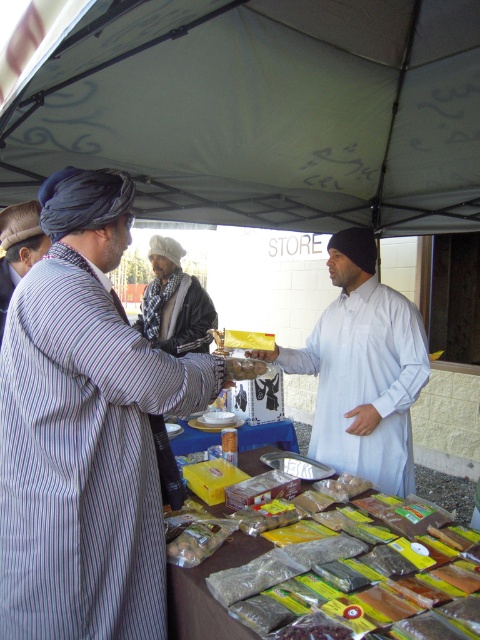
Question: Among these points, which one is farthest from the camera?

Choices:
 (A) (408, 212)
 (B) (35, 212)
 (C) (22, 356)

Answer: (A)

Question: Does striped fabric coat at left come in front of striped fabric headscarf at left?

Choices:
 (A) no
 (B) yes

Answer: (B)

Question: Estimate the real-world distances between objects in this image. Which object is closer to the white matte shirt at center?

Choices:
 (A) white fabric canopy at upper center
 (B) striped fabric coat at left

Answer: (B)

Question: Can you confirm if white matte shirt at center is positioned to the left of striped fabric headscarf at left?

Choices:
 (A) yes
 (B) no

Answer: (B)

Question: Can you confirm if white fabric canopy at upper center is thinner than striped fabric coat at left?

Choices:
 (A) yes
 (B) no

Answer: (B)

Question: Which of the following is the farthest from the observer?

Choices:
 (A) (227, 380)
 (B) (17, 220)

Answer: (B)